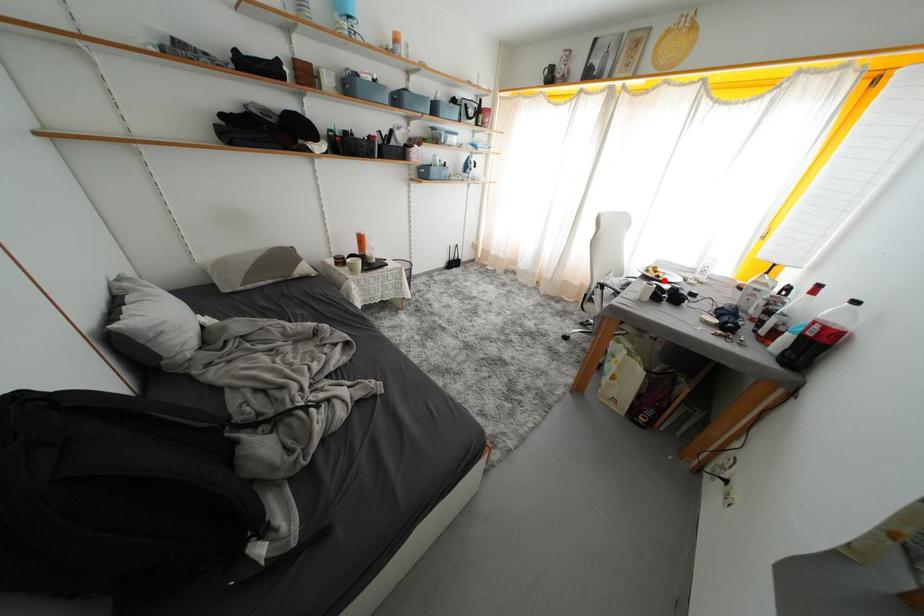
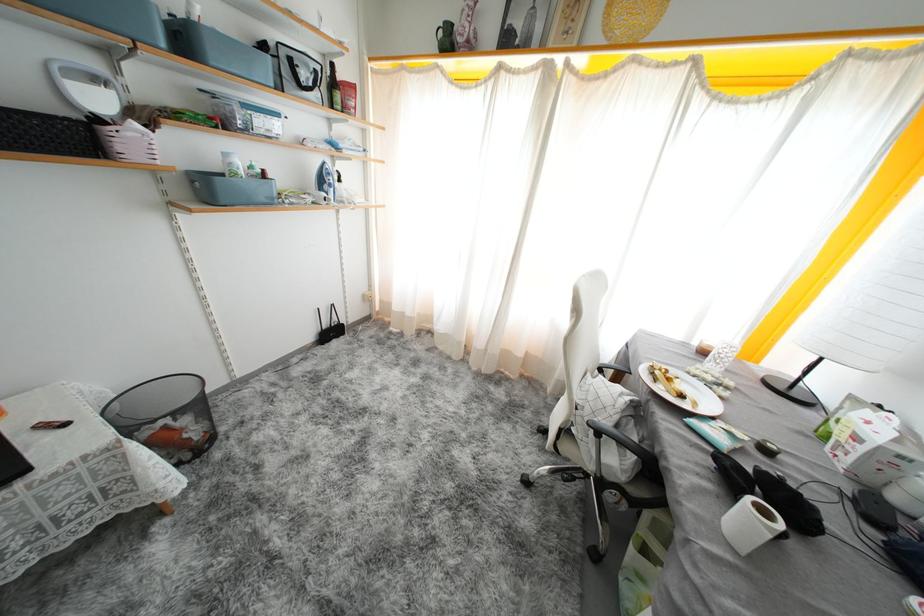
Where in the second image is the point corresponding to the highlighted location from the first image?

(687, 400)